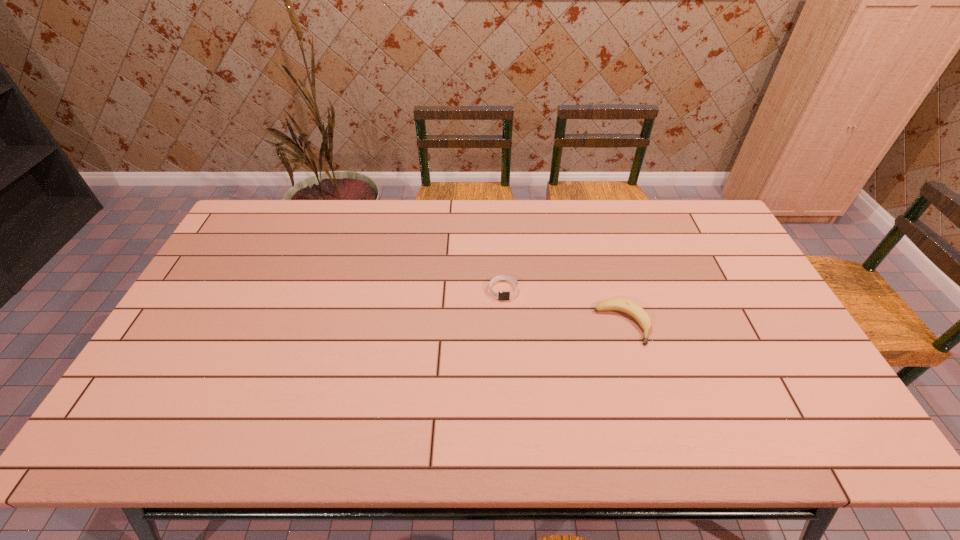
You are a GUI agent. You are given a task and a screenshot of the screen. Output one action in this format:
    pyautogui.click(x=<x>, y=<y>)
    Task: Click on the taller object
    This screenshot has height=540, width=960.
    Given the screenshot: What is the action you would take?
    pyautogui.click(x=638, y=313)

I want to click on the nearer object, so click(x=638, y=313).

This screenshot has height=540, width=960. What are the coordinates of `the left object` in the screenshot? It's located at (500, 295).

The width and height of the screenshot is (960, 540). I want to click on wristband, so click(500, 295).

You are a GUI agent. You are given a task and a screenshot of the screen. Output one action in this format:
    pyautogui.click(x=<x>, y=<y>)
    Task: Click on the vacant space located 0.340m on the back of the banana
    The height and width of the screenshot is (540, 960).
    Given the screenshot: What is the action you would take?
    pyautogui.click(x=595, y=231)

Where is `free point located on the outer surface of the left object`? This screenshot has width=960, height=540. free point located on the outer surface of the left object is located at coordinates (508, 373).

Where is `vacant space at the far edge`? The width and height of the screenshot is (960, 540). vacant space at the far edge is located at coordinates (537, 234).

Identify the location of vacant point at the near edge. Image resolution: width=960 pixels, height=540 pixels. (564, 422).

The width and height of the screenshot is (960, 540). What are the coordinates of `vacant space at the left edge` in the screenshot? It's located at (259, 264).

This screenshot has width=960, height=540. In order to click on free space at the right edge in this screenshot , I will do `click(802, 398)`.